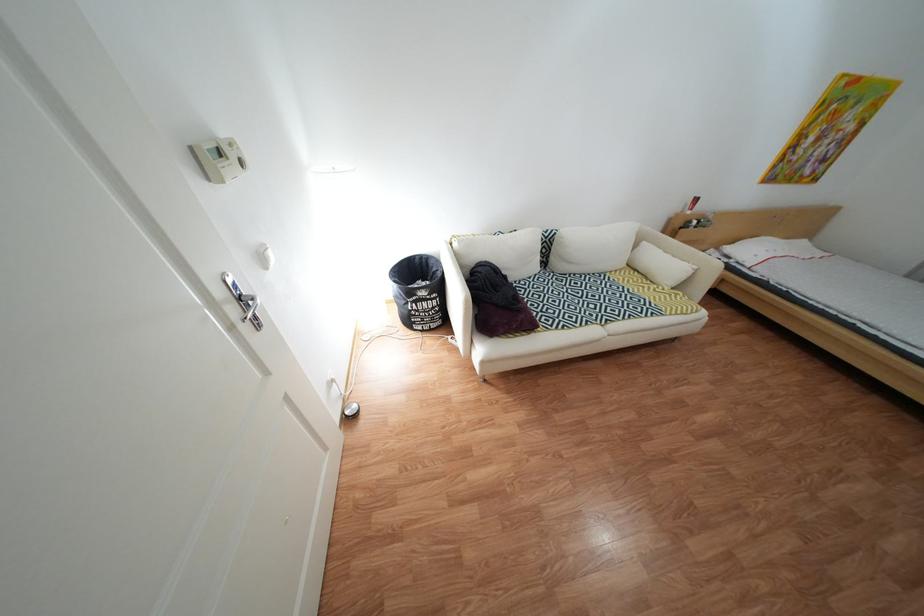
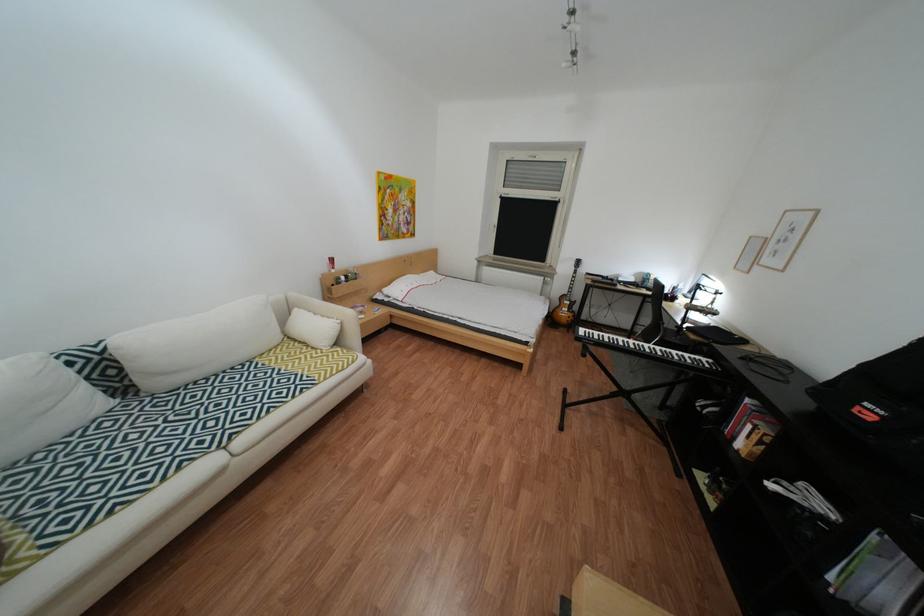
Question: The images are taken continuously from a first-person perspective. In which direction is your viewpoint rotating?

Choices:
 (A) Left
 (B) Right
 (C) Up
 (D) Down

Answer: (B)